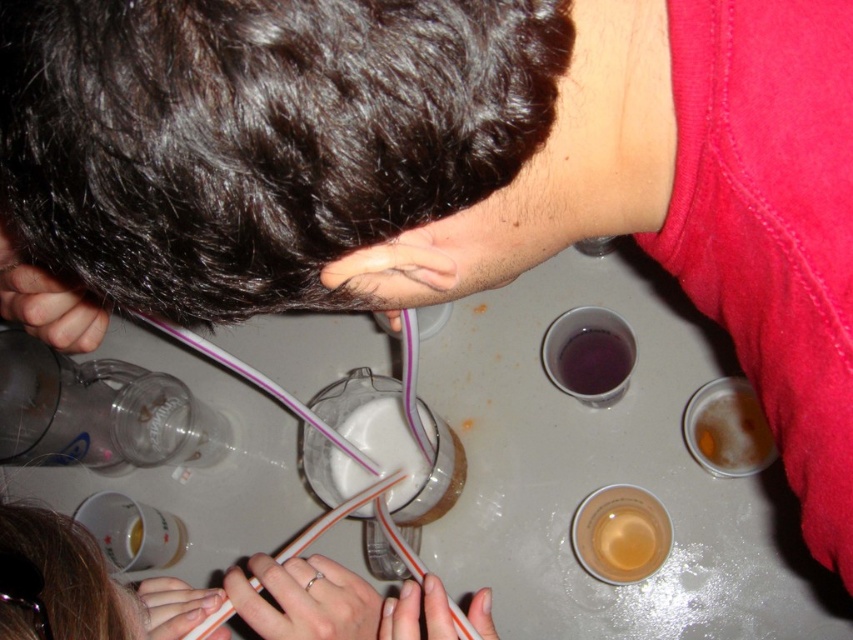
You are at a social gathering and want to grab a drink from the table. There are two points on the table marked as point 1 at coordinates point (252, 566) and point 2 at coordinates point (589, 349). Which point is closer to you?

Point (252, 566) is closer to the viewer than point (589, 349).

You are a person at the gathering and want to place your silver metallic ring at lower center on the table without it falling off. Considering the table edges are at coordinates 0,0 to 1,1, where 0,0 is the bottom left corner and 1,1 is the top right corner, is the ring safely placed?

The silver metallic ring at lower center is located at point (305, 600) which is within the table boundaries of (0, 0) to (852, 639) so it is safely placed and won